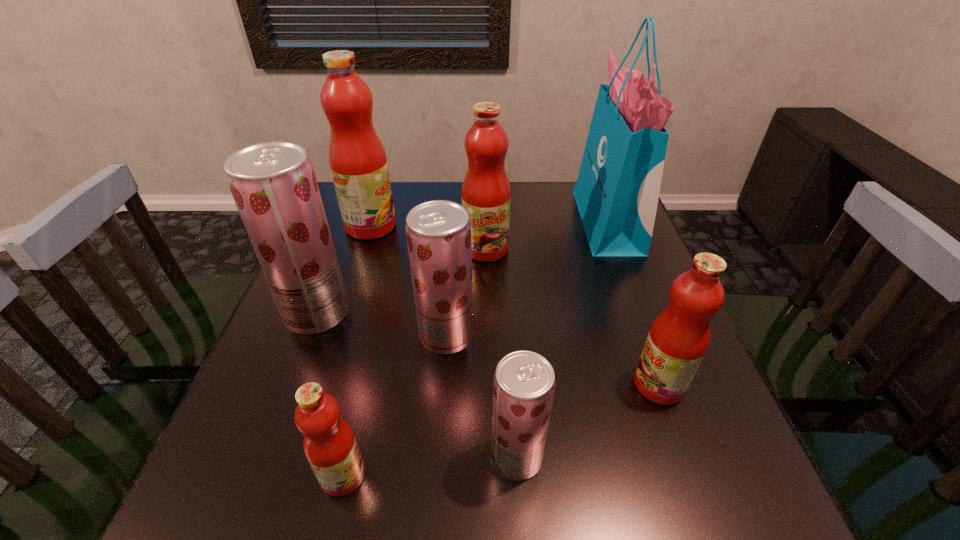
Where is `free location that satisfies the following two spatial constraints: 1. on the back side of the nearest strawberry fruit juice; 2. on the right side of the shopping bag`? free location that satisfies the following two spatial constraints: 1. on the back side of the nearest strawberry fruit juice; 2. on the right side of the shopping bag is located at coordinates (501, 221).

This screenshot has height=540, width=960. I want to click on free spot that satisfies the following two spatial constraints: 1. on the front label of the third pink fruit juice from left to right; 2. on the front label of the nearest pink fruit juice, so coord(490,475).

You are a GUI agent. You are given a task and a screenshot of the screen. Output one action in this format:
    pyautogui.click(x=<x>, y=<y>)
    Task: Click on the vacant point that satisfies the following two spatial constraints: 1. on the front side of the second strawberry fruit juice from right to left; 2. on the front label of the smallest pink fruit juice
    The width and height of the screenshot is (960, 540).
    Given the screenshot: What is the action you would take?
    pyautogui.click(x=436, y=475)